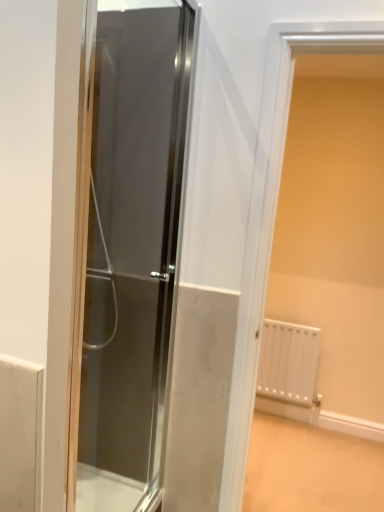
Measure the distance between point (152,339) and camera.

Point (152,339) is 1.77 meters away from camera.

Find the location of `transparent glass door at center`. transparent glass door at center is located at coordinates (132, 252).

Describe the element at coordinates (132, 252) in the screenshot. I see `transparent glass door at center` at that location.

The image size is (384, 512). What do you see at coordinates (273, 212) in the screenshot? I see `white matte radiator at right` at bounding box center [273, 212].

You are a GUI agent. You are given a task and a screenshot of the screen. Output one action in this format:
    pyautogui.click(x=<x>, y=<y>)
    Task: Click on the white matte radiator at right
    The height and width of the screenshot is (512, 384).
    Given the screenshot: What is the action you would take?
    pyautogui.click(x=273, y=212)

In order to face white matte radiator at right, should I rotate leftwards or rightwards?

A 19.083 degree turn to the right will do.

Measure the distance between point (x=283, y=51) and camera.

1.45 meters.

The height and width of the screenshot is (512, 384). Find the location of `transparent glass door at center`. transparent glass door at center is located at coordinates (132, 252).

Does transparent glass door at center appear on the right side of white matte radiator at right?

No.

Does transparent glass door at center lie behind white matte radiator at right?

That is False.

Is point (176, 133) farther from camera compared to point (256, 339)?

No, (176, 133) is in front of (256, 339).

From the image's perspective, which is above, transparent glass door at center or white matte radiator at right?

transparent glass door at center.

From a real-world perspective, is transparent glass door at center over white matte radiator at right?

Yes, from a real-world perspective, transparent glass door at center is over white matte radiator at right

Is transparent glass door at center wider than white matte radiator at right?

Incorrect, the width of transparent glass door at center does not surpass that of white matte radiator at right.

In terms of height, does transparent glass door at center look taller or shorter compared to white matte radiator at right?

Considering their sizes, transparent glass door at center has more height than white matte radiator at right.

Considering the relative sizes of transparent glass door at center and white matte radiator at right in the image provided, is transparent glass door at center bigger than white matte radiator at right?

Actually, transparent glass door at center might be smaller than white matte radiator at right.

Is transparent glass door at center spatially inside white matte radiator at right, or outside of it?

transparent glass door at center lies outside white matte radiator at right.

Can you see transparent glass door at center touching white matte radiator at right?

No, transparent glass door at center is not next to white matte radiator at right.

Is transparent glass door at center facing away from white matte radiator at right?

transparent glass door at center is not turned away from white matte radiator at right.

How many degrees apart are the facing directions of transparent glass door at center and white matte radiator at right?

89 degrees.

Locate an element on the screen. The height and width of the screenshot is (512, 384). door lying above the white matte radiator at right (from the image's perspective) is located at coordinates (132, 252).

Which object is positioned more to the right, white matte radiator at right or transparent glass door at center?

From the viewer's perspective, white matte radiator at right appears more on the right side.

From the picture: Considering their positions, is white matte radiator at right located in front of or behind transparent glass door at center?

white matte radiator at right is behind transparent glass door at center.

Which is behind, point (224, 506) or point (118, 154)?

The point (224, 506) is behind.

From the image's perspective, is white matte radiator at right above or below transparent glass door at center?

Clearly, from the image's perspective, white matte radiator at right is below transparent glass door at center.

From a real-world perspective, is white matte radiator at right beneath transparent glass door at center?

Yes, from a real-world perspective, white matte radiator at right is under transparent glass door at center.

Looking at this image, considering the sizes of objects white matte radiator at right and transparent glass door at center in the image provided, who is wider, white matte radiator at right or transparent glass door at center?

white matte radiator at right.

Is white matte radiator at right taller than transparent glass door at center?

Incorrect, the height of white matte radiator at right is not larger of that of transparent glass door at center.

Looking at the image, does white matte radiator at right seem bigger or smaller compared to transparent glass door at center?

white matte radiator at right is bigger than transparent glass door at center.

Is transparent glass door at center surrounded by white matte radiator at right?

No, transparent glass door at center is not a part of white matte radiator at right.

Is white matte radiator at right positioned far away from transparent glass door at center?

They are positioned close to each other.

Is white matte radiator at right oriented towards transparent glass door at center?

No, white matte radiator at right is not turned towards transparent glass door at center.

What's the angular difference between white matte radiator at right and transparent glass door at center's facing directions?

89 degrees.

Identify the location of door above the white matte radiator at right (from a real-world perspective). The width and height of the screenshot is (384, 512). (132, 252).

I want to click on door located above the white matte radiator at right (from a real-world perspective), so click(x=132, y=252).

Locate an element on the screen. The width and height of the screenshot is (384, 512). door above the white matte radiator at right (from the image's perspective) is located at coordinates (132, 252).